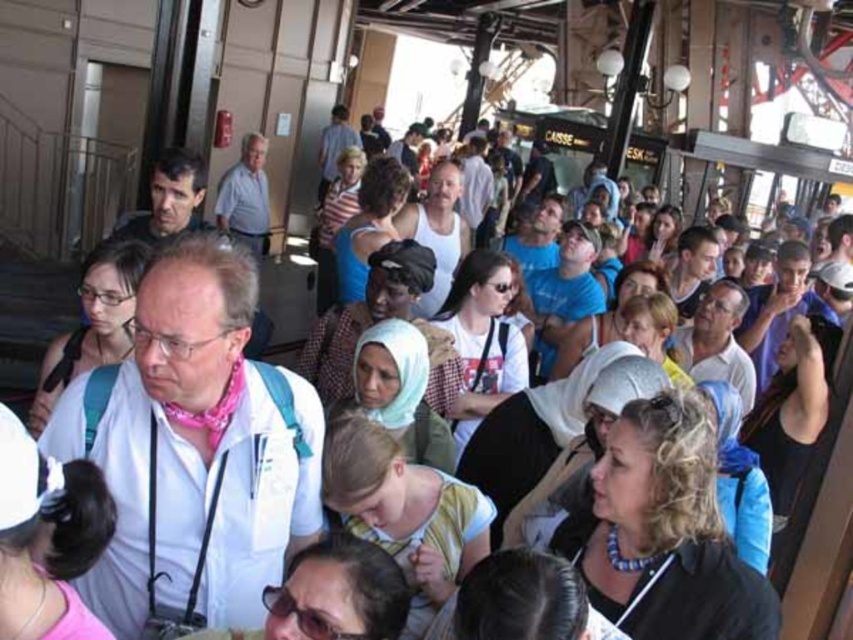
You are a photographer trying to capture a candid shot of the crowd at the train station. You notice two individuals wearing a white cotton shirt at center and a black leather jacket at lower right. Since you want to ensure both are clearly visible in your photo, which person should you focus on to capture their full figure without cropping?

The white cotton shirt at center should be focused on because it is larger in size than the black leather jacket at lower right, making it easier to capture the full figure without cropping.

Looking at this image, you are a photographer trying to capture a candid shot of the white cotton shirt at center and the black leather jacket at lower right. Since you want to ensure both subjects are in focus, you need to know their vertical positions. Which one is positioned higher?

The white cotton shirt at center is located above the black leather jacket at lower right, so it is positioned higher.